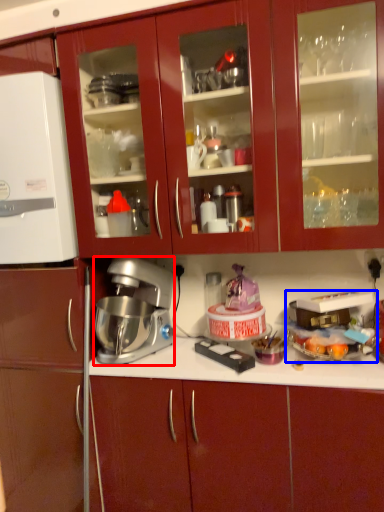
Question: Which of the following is the farthest to the observer, mixer (highlighted by a red box) or appliance (highlighted by a blue box)?

Choices:
 (A) mixer
 (B) appliance

Answer: (A)